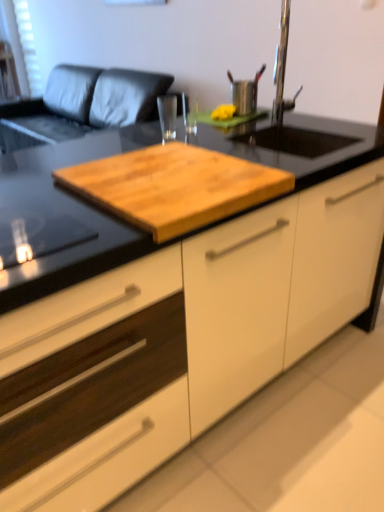
Question: Are white mesh screen at upper left and white matte cabinet at center making contact?

Choices:
 (A) no
 (B) yes

Answer: (A)

Question: Is white mesh screen at upper left to the left of white matte cabinet at center from the viewer's perspective?

Choices:
 (A) yes
 (B) no

Answer: (A)

Question: Are white mesh screen at upper left and white matte cabinet at center located far from each other?

Choices:
 (A) no
 (B) yes

Answer: (B)

Question: Does white mesh screen at upper left have a smaller size compared to white matte cabinet at center?

Choices:
 (A) no
 (B) yes

Answer: (B)

Question: From the image's perspective, is white mesh screen at upper left below white matte cabinet at center?

Choices:
 (A) no
 (B) yes

Answer: (A)

Question: From a real-world perspective, is white matte cabinet at center above or below white mesh screen at upper left?

Choices:
 (A) above
 (B) below

Answer: (B)

Question: From the image's perspective, is white matte cabinet at center located above or below white mesh screen at upper left?

Choices:
 (A) below
 (B) above

Answer: (A)

Question: In the image, is white matte cabinet at center on the left side or the right side of white mesh screen at upper left?

Choices:
 (A) right
 (B) left

Answer: (A)

Question: Relative to white mesh screen at upper left, is white matte cabinet at center in front or behind?

Choices:
 (A) behind
 (B) front

Answer: (B)

Question: Is white mesh screen at upper left inside or outside of white matte cabinet at center?

Choices:
 (A) outside
 (B) inside

Answer: (A)

Question: From the image's perspective, is white mesh screen at upper left above or below white matte cabinet at center?

Choices:
 (A) below
 (B) above

Answer: (B)

Question: Considering the positions of white mesh screen at upper left and white matte cabinet at center in the image, is white mesh screen at upper left taller or shorter than white matte cabinet at center?

Choices:
 (A) tall
 (B) short

Answer: (A)

Question: From a real-world perspective, relative to white matte cabinet at center, is white mesh screen at upper left vertically above or below?

Choices:
 (A) below
 (B) above

Answer: (B)

Question: Is white matte cabinet at center situated inside metallic stainless steel cup at upper center or outside?

Choices:
 (A) inside
 (B) outside

Answer: (B)

Question: From a real-world perspective, is white matte cabinet at center positioned above or below metallic stainless steel cup at upper center?

Choices:
 (A) above
 (B) below

Answer: (B)